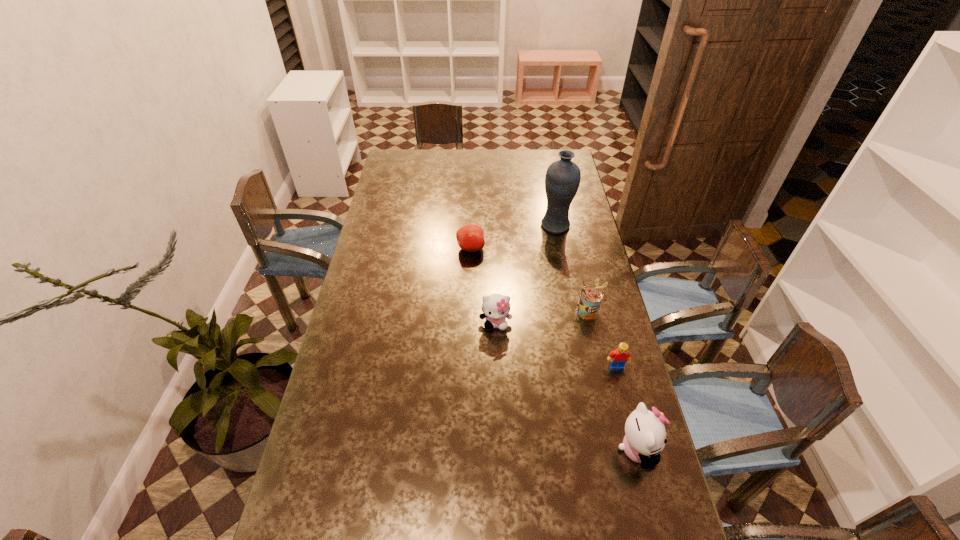
The height and width of the screenshot is (540, 960). I want to click on object that is the fourth closest to the vase, so click(x=618, y=358).

You are a GUI agent. You are given a task and a screenshot of the screen. Output one action in this format:
    pyautogui.click(x=<x>, y=<y>)
    Task: Click on the object that can be found as the third closest to the apple
    
    Given the screenshot: What is the action you would take?
    (x=590, y=299)